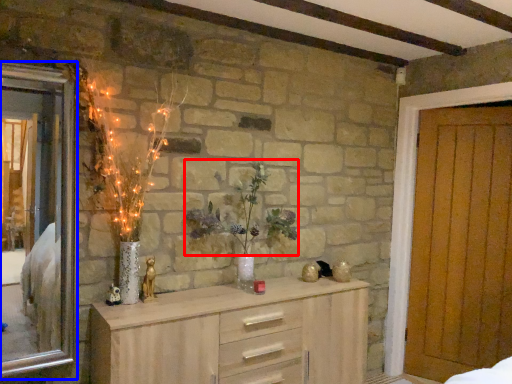
Question: Which point is closer to the camera, floral arrangement (highlighted by a red box) or window (highlighted by a blue box)?

Choices:
 (A) floral arrangement
 (B) window

Answer: (B)